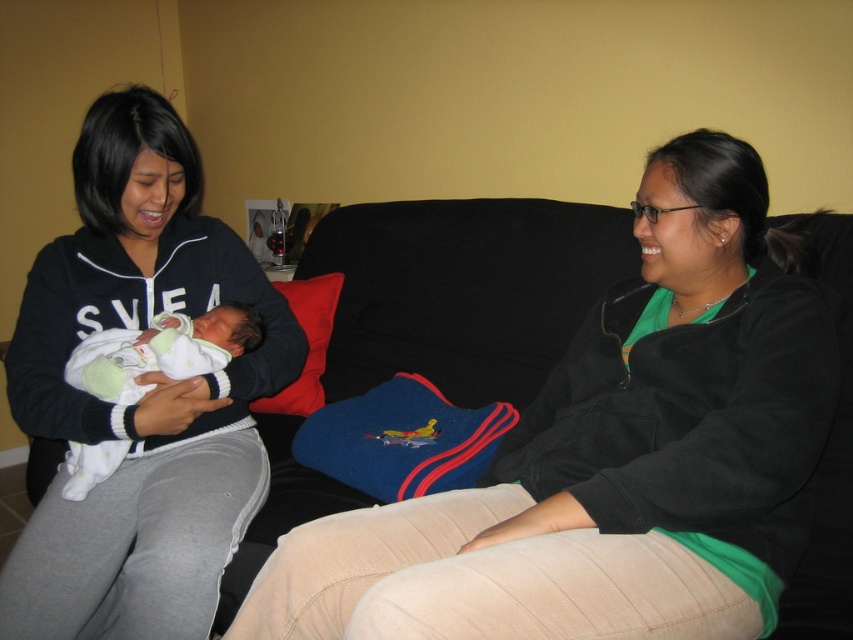
Who is lower down, matte black hoodie at left or white knit sweater at left?

Positioned lower is white knit sweater at left.

Can you confirm if matte black hoodie at left is taller than white knit sweater at left?

Correct, matte black hoodie at left is much taller as white knit sweater at left.

This screenshot has width=853, height=640. Describe the element at coordinates (140, 400) in the screenshot. I see `matte black hoodie at left` at that location.

You are a GUI agent. You are given a task and a screenshot of the screen. Output one action in this format:
    pyautogui.click(x=<x>, y=<y>)
    Task: Click on the matte black hoodie at left
    This screenshot has height=640, width=853.
    Given the screenshot: What is the action you would take?
    pyautogui.click(x=140, y=400)

Measure the distance between matte black jacket at center and white knit sweater at left.

The distance of matte black jacket at center from white knit sweater at left is 22.73 inches.

Is point (715, 600) positioned in front of point (169, 364)?

Yes, it is.

The image size is (853, 640). What are the coordinates of `matte black jacket at center` in the screenshot? It's located at (614, 456).

Who is positioned more to the right, matte black jacket at center or matte black hoodie at left?

matte black jacket at center

Is the position of matte black jacket at center more distant than that of matte black hoodie at left?

No, it is in front of matte black hoodie at left.

Between point (308, 561) and point (223, 504), which one is positioned behind?

Point (223, 504)

The height and width of the screenshot is (640, 853). Identify the location of matte black jacket at center. (614, 456).